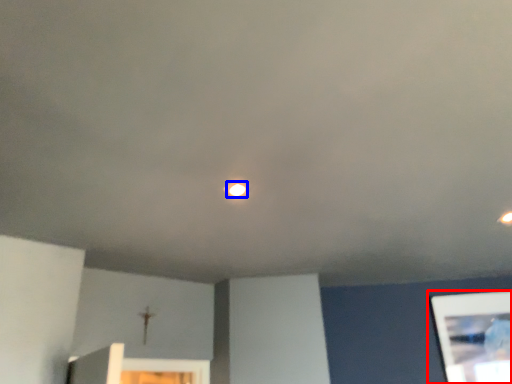
Question: Which point is closer to the camera, picture frame (highlighted by a red box) or light (highlighted by a blue box)?

Choices:
 (A) picture frame
 (B) light

Answer: (B)